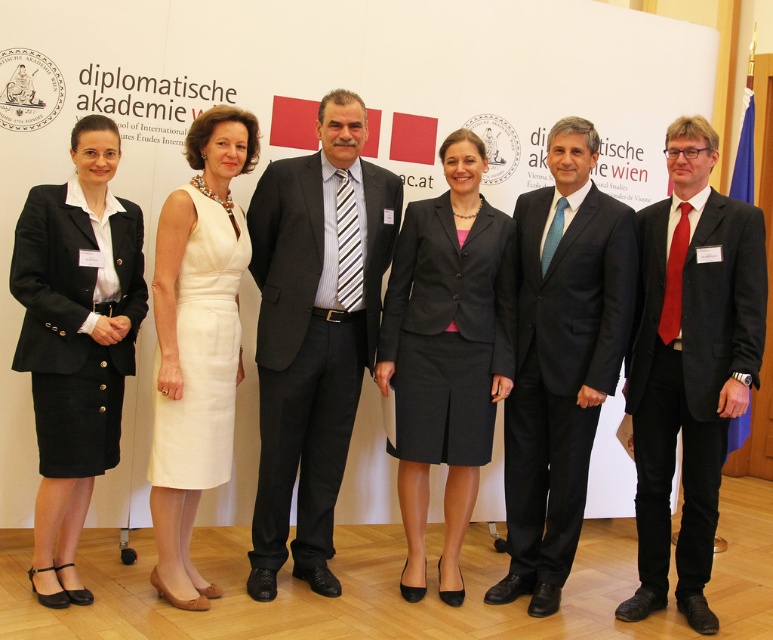
You are organizing a photo shoot and need to arrange the dark gray wool suit at center and the matte black suit at right in a row. Based on the image, which suit should be placed first if you want to arrange them from widest to narrowest?

The dark gray wool suit at center should be placed first since it might be wider than the matte black suit at right according to the description.

You are organizing a photo shoot and need to ensure that all outfits fit within a 1.2 meter wide backdrop. Given the black wool suit at center and the white textured dress at center, which outfit requires more space horizontally?

The black wool suit at center requires more space horizontally because its width is larger than the white textured dress at center.